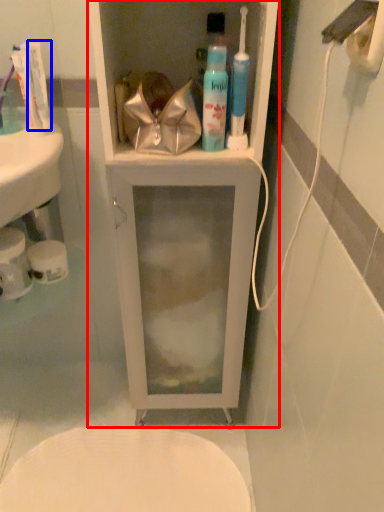
Question: Which object is closer to the camera taking this photo, bathroom cabinet (highlighted by a red box) or toothpaste (highlighted by a blue box)?

Choices:
 (A) bathroom cabinet
 (B) toothpaste

Answer: (A)